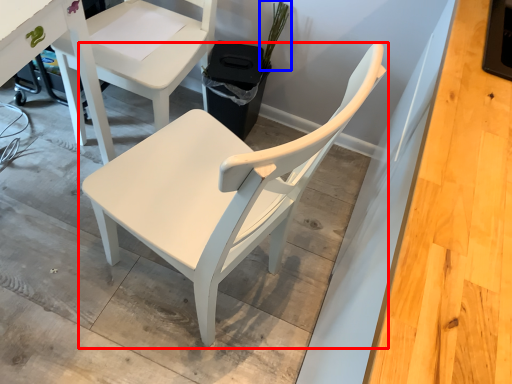
Question: Which point is closer to the camera, chair (highlighted by a red box) or plant (highlighted by a blue box)?

Choices:
 (A) chair
 (B) plant

Answer: (A)